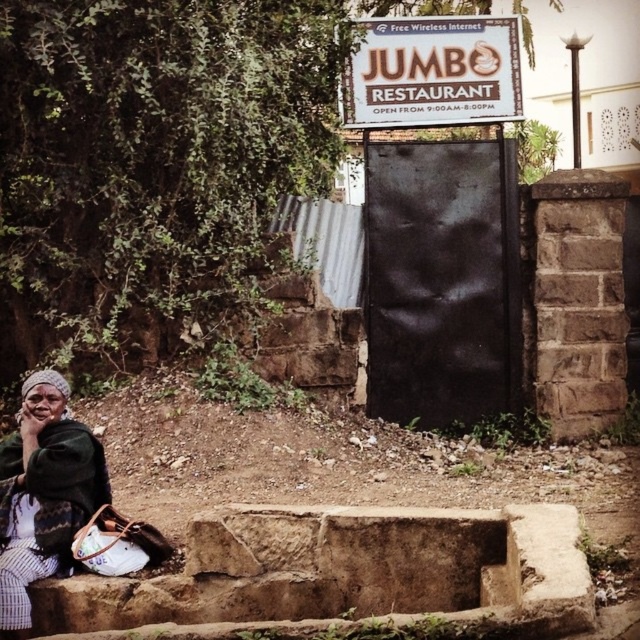
Does brown stone ledge at lower center have a lesser height compared to green woven fabric at lower left?

Yes, brown stone ledge at lower center is shorter than green woven fabric at lower left.

Who is more distant from viewer, [129,627] or [72,440]?

The point [72,440] is behind.

Image resolution: width=640 pixels, height=640 pixels. In order to click on brown stone ledge at lower center in this screenshot , I will do `click(344, 577)`.

Which is in front, point (312, 621) or point (419, 44)?

Point (312, 621)

What do you see at coordinates (344, 577) in the screenshot? I see `brown stone ledge at lower center` at bounding box center [344, 577].

Locate an element on the screen. brown stone ledge at lower center is located at coordinates (344, 577).

Which is above, white plastic sign at upper center or green woven fabric at lower left?

white plastic sign at upper center

Is white plastic sign at upper center to the right of green woven fabric at lower left from the viewer's perspective?

Yes, white plastic sign at upper center is to the right of green woven fabric at lower left.

Which is in front, point (355, 52) or point (29, 525)?

Point (29, 525)

This screenshot has width=640, height=640. I want to click on white plastic sign at upper center, so click(433, 72).